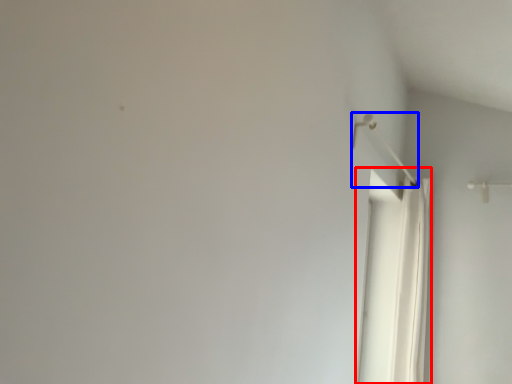
Question: Which object is further to the camera taking this photo, shower curtain (highlighted by a red box) or shower (highlighted by a blue box)?

Choices:
 (A) shower curtain
 (B) shower

Answer: (A)